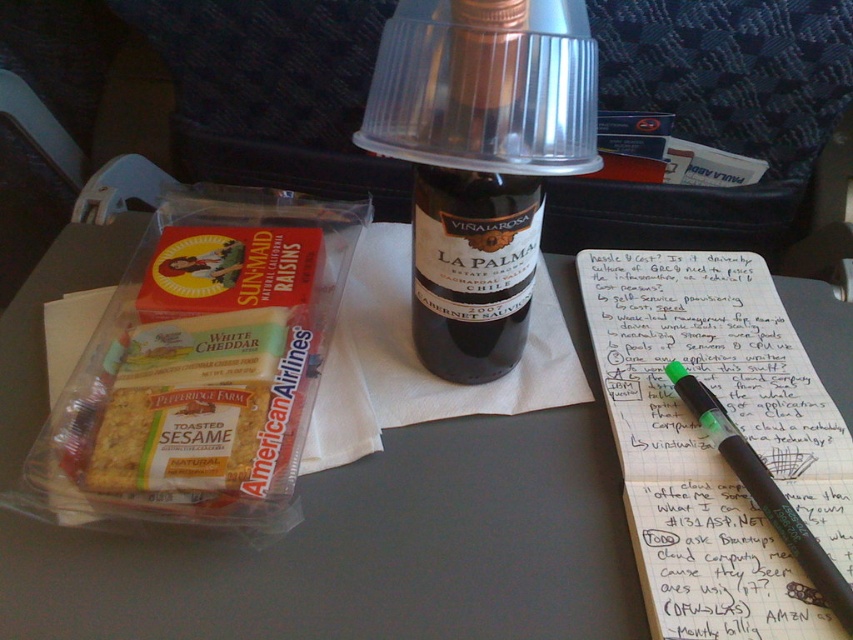
Who is more forward, (646, 592) or (827, 592)?

Point (827, 592) is in front.

Which is above, green pen at upper right or green matte pen at upper right?

green pen at upper right is higher up.

What do you see at coordinates (711, 444) in the screenshot? The width and height of the screenshot is (853, 640). I see `green pen at upper right` at bounding box center [711, 444].

Identify the location of green pen at upper right. (711, 444).

Between point (611, 561) and point (476, 84), which one is positioned behind?

Point (611, 561)

Does matte plastic tray at center have a smaller size compared to dark glass bottle at center?

No.

Locate an element on the screen. This screenshot has width=853, height=640. matte plastic tray at center is located at coordinates (376, 544).

The height and width of the screenshot is (640, 853). Identify the location of matte plastic tray at center. (376, 544).

Who is positioned more to the right, white cheddar cheese at center or green matte pen at upper right?

green matte pen at upper right

Identify the location of white cheddar cheese at center. (206, 369).

You are a GUI agent. You are given a task and a screenshot of the screen. Output one action in this format:
    pyautogui.click(x=<x>, y=<y>)
    Task: Click on the white cheddar cheese at center
    The image size is (853, 640).
    Given the screenshot: What is the action you would take?
    pyautogui.click(x=206, y=369)